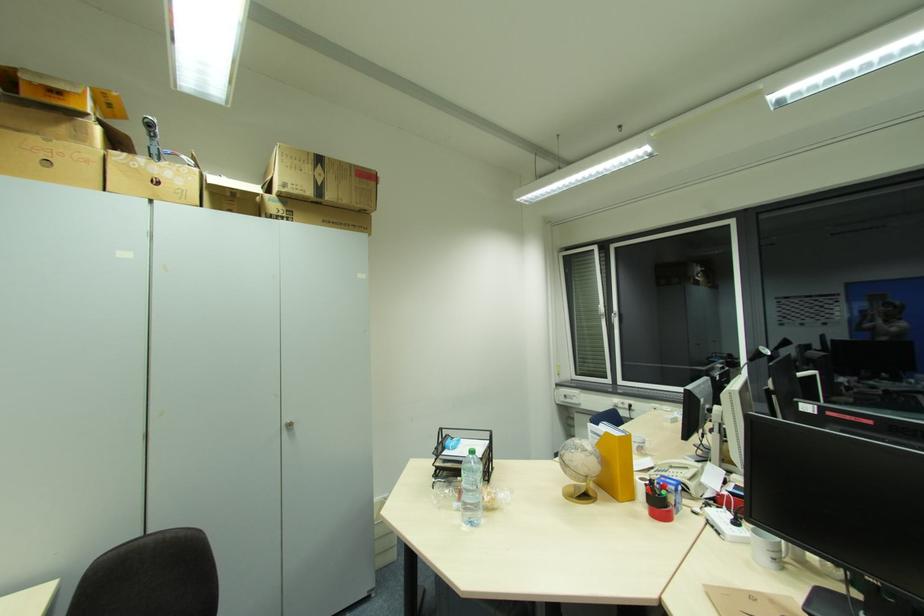
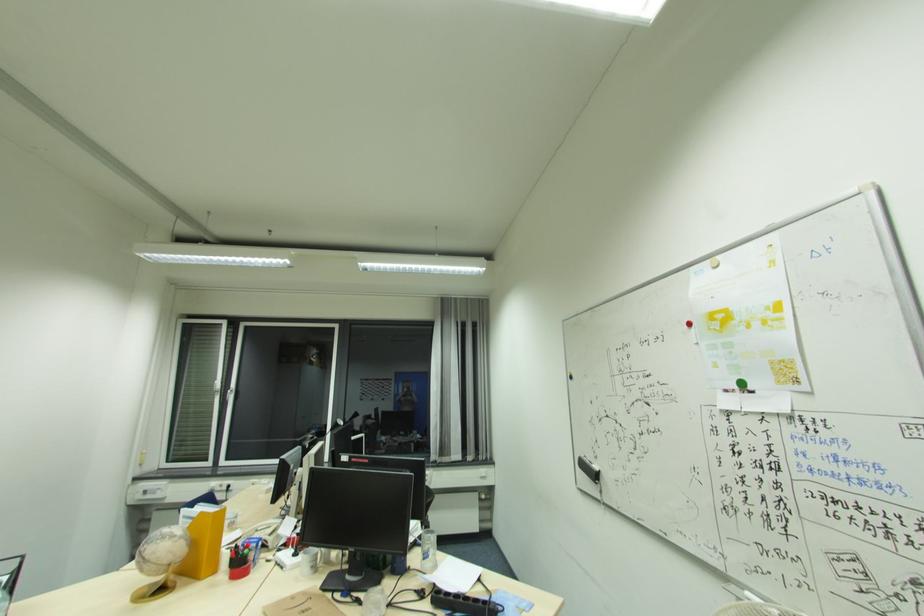
The point at (666, 488) is marked in the first image. Where is the corresponding point in the second image?

(250, 548)